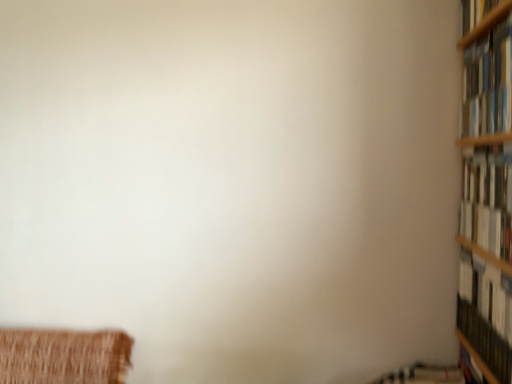
Image resolution: width=512 pixels, height=384 pixels. Describe the element at coordinates (488, 83) in the screenshot. I see `hardcover books at upper right, the third book positioned from the bottom` at that location.

I want to click on hardcover books at upper right, which is counted as the first book, starting from the top, so click(x=488, y=83).

In the scene shown: Are hardcover books at upper right, which is counted as the first book, starting from the top, and white paper book at right, the 2th book from the bottom, beside each other?

No, hardcover books at upper right, which is counted as the first book, starting from the top, is not touching white paper book at right, the 2th book from the bottom.

Is hardcover books at upper right, the third book positioned from the bottom, positioned with its back to white paper book at right, the 2th book from the bottom?

No, hardcover books at upper right, the third book positioned from the bottom, is not facing away from white paper book at right, the 2th book from the bottom.

Is hardcover books at upper right, the third book positioned from the bottom, closer to camera compared to white paper book at right, the second book from the top?

Yes.

From a real-world perspective, is hardcover books at upper right, which is counted as the first book, starting from the top, located higher than white paper book at right, the second book from the top?

Yes, from a real-world perspective, hardcover books at upper right, which is counted as the first book, starting from the top, is on top of white paper book at right, the second book from the top.

Does hardcover books at upper right, the third book positioned from the bottom, have a lesser height compared to hardcover book at right, acting as the first book starting from the bottom?

Incorrect, the height of hardcover books at upper right, the third book positioned from the bottom, does not fall short of that of hardcover book at right, acting as the first book starting from the bottom.

Does point (506, 56) appear closer or farther from the camera than point (463, 303)?

Clearly, point (506, 56) is closer to the camera than point (463, 303).

In terms of width, does hardcover books at upper right, which is counted as the first book, starting from the top, look wider or thinner when compared to hardcover book at right, acting as the first book starting from the bottom?

In the image, hardcover books at upper right, which is counted as the first book, starting from the top, appears to be wider than hardcover book at right, acting as the first book starting from the bottom.

From a real-world perspective, count 2nd books upward from the hardcover book at right, the third book when ordered from top to bottom, and point to it. Please provide its 2D coordinates.

[(488, 83)]

Considering the positions of points (494, 223) and (485, 338), is point (494, 223) farther from camera compared to point (485, 338)?

That is False.

From a real-world perspective, which is physically below, white paper book at right, the 2th book from the bottom, or hardcover book at right, acting as the first book starting from the bottom?

From a 3D spatial view, hardcover book at right, acting as the first book starting from the bottom, is below.

In the scene shown: Which of these two, white paper book at right, the 2th book from the bottom, or hardcover book at right, the third book when ordered from top to bottom, is wider?

white paper book at right, the 2th book from the bottom, is wider.

How many degrees apart are the facing directions of white paper book at right, the second book from the top, and hardcover books at upper right, which is counted as the first book, starting from the top?

The facing directions of white paper book at right, the second book from the top, and hardcover books at upper right, which is counted as the first book, starting from the top, are 0.00166 degrees apart.

Consider the image. Considering the relative positions of white paper book at right, the second book from the top, and hardcover books at upper right, which is counted as the first book, starting from the top, in the image provided, is white paper book at right, the second book from the top, to the left or to the right of hardcover books at upper right, which is counted as the first book, starting from the top,?

From the image, it's evident that white paper book at right, the second book from the top, is to the right of hardcover books at upper right, which is counted as the first book, starting from the top.

From a real-world perspective, is white paper book at right, the 2th book from the bottom, on hardcover books at upper right, the third book positioned from the bottom?

No.

Between point (510, 184) and point (477, 83), which one is positioned in front?

Point (510, 184)

From the image's perspective, which is below, hardcover book at right, acting as the first book starting from the bottom, or hardcover books at upper right, the third book positioned from the bottom?

hardcover book at right, acting as the first book starting from the bottom, from the image's perspective.

How different are the orientations of hardcover book at right, the third book when ordered from top to bottom, and hardcover books at upper right, which is counted as the first book, starting from the top, in degrees?

The angular difference between hardcover book at right, the third book when ordered from top to bottom, and hardcover books at upper right, which is counted as the first book, starting from the top, is 0.00182 degrees.

Considering the sizes of hardcover book at right, acting as the first book starting from the bottom, and hardcover books at upper right, the third book positioned from the bottom, in the image, is hardcover book at right, acting as the first book starting from the bottom, bigger or smaller than hardcover books at upper right, the third book positioned from the bottom,?

Considering their sizes, hardcover book at right, acting as the first book starting from the bottom, takes up less space than hardcover books at upper right, the third book positioned from the bottom.

Which object is closer to the camera taking this photo, hardcover book at right, acting as the first book starting from the bottom, or hardcover books at upper right, the third book positioned from the bottom?

hardcover books at upper right, the third book positioned from the bottom.

From the image's perspective, who appears lower, hardcover book at right, acting as the first book starting from the bottom, or white paper book at right, the 2th book from the bottom?

From the image's view, hardcover book at right, acting as the first book starting from the bottom, is below.

Identify the location of book behind the white paper book at right, the 2th book from the bottom. (481, 321).

Which of these two, hardcover book at right, acting as the first book starting from the bottom, or white paper book at right, the second book from the top, stands taller?

With more height is white paper book at right, the second book from the top.

Based on the photo, from a real-world perspective, is hardcover book at right, acting as the first book starting from the bottom, positioned under white paper book at right, the second book from the top, based on gravity?

Yes, from a real-world perspective, hardcover book at right, acting as the first book starting from the bottom, is beneath white paper book at right, the second book from the top.

Where is `the 1st book behind the hardcover books at upper right, the third book positioned from the bottom`? The image size is (512, 384). the 1st book behind the hardcover books at upper right, the third book positioned from the bottom is located at coordinates (488, 201).

Where is `book that is the 2nd one when counting rightward from the hardcover books at upper right, which is counted as the first book, starting from the top`? book that is the 2nd one when counting rightward from the hardcover books at upper right, which is counted as the first book, starting from the top is located at coordinates (481, 321).

Estimate the real-world distances between objects in this image. Which object is further from hardcover book at right, acting as the first book starting from the bottom, hardcover books at upper right, the third book positioned from the bottom, or white paper book at right, the second book from the top?

Based on the image, hardcover books at upper right, the third book positioned from the bottom, appears to be further to hardcover book at right, acting as the first book starting from the bottom.

Considering their positions, is hardcover books at upper right, which is counted as the first book, starting from the top, positioned closer to white paper book at right, the 2th book from the bottom, than hardcover book at right, acting as the first book starting from the bottom?

hardcover books at upper right, which is counted as the first book, starting from the top, is closer to white paper book at right, the 2th book from the bottom.

Estimate the real-world distances between objects in this image. Which object is further from hardcover book at right, the third book when ordered from top to bottom, white paper book at right, the 2th book from the bottom, or hardcover books at upper right, which is counted as the first book, starting from the top?

Among the two, hardcover books at upper right, which is counted as the first book, starting from the top, is located further to hardcover book at right, the third book when ordered from top to bottom.

Which object lies further to the anchor point hardcover books at upper right, the third book positioned from the bottom, white paper book at right, the second book from the top, or hardcover book at right, acting as the first book starting from the bottom?

Among the two, hardcover book at right, acting as the first book starting from the bottom, is located further to hardcover books at upper right, the third book positioned from the bottom.

From the image, which object appears to be nearer to white paper book at right, the second book from the top, hardcover book at right, the third book when ordered from top to bottom, or hardcover books at upper right, the third book positioned from the bottom?

hardcover books at upper right, the third book positioned from the bottom.

When comparing their distances from hardcover books at upper right, which is counted as the first book, starting from the top, does hardcover book at right, the third book when ordered from top to bottom, or white paper book at right, the second book from the top, seem further?

hardcover book at right, the third book when ordered from top to bottom, is positioned further to the anchor hardcover books at upper right, which is counted as the first book, starting from the top.

The height and width of the screenshot is (384, 512). What are the coordinates of `book between hardcover books at upper right, which is counted as the first book, starting from the top, and hardcover book at right, the third book when ordered from top to bottom, from top to bottom` in the screenshot? It's located at (488, 201).